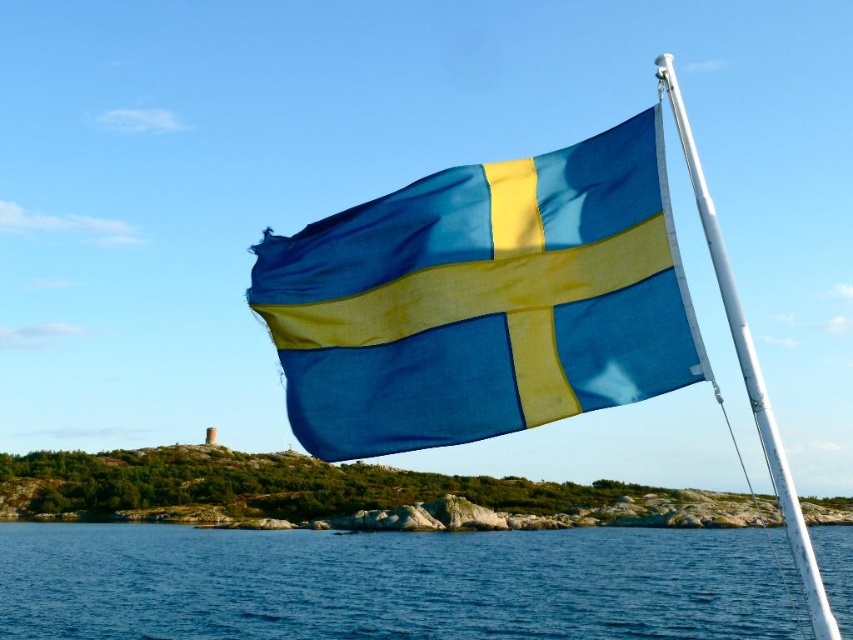
Is point (434, 380) farther from camera compared to point (773, 444)?

Yes, point (434, 380) is farther from viewer.

Who is taller, blue fabric flag at upper right or white metallic pole at upper right?

white metallic pole at upper right

What do you see at coordinates (483, 300) in the screenshot? Image resolution: width=853 pixels, height=640 pixels. I see `blue fabric flag at upper right` at bounding box center [483, 300].

The width and height of the screenshot is (853, 640). Identify the location of blue fabric flag at upper right. (483, 300).

How much distance is there between blue fabric flag at upper right and blue water at lower left?

A distance of 286.80 feet exists between blue fabric flag at upper right and blue water at lower left.

Is blue fabric flag at upper right positioned at the back of blue water at lower left?

Yes, it is behind blue water at lower left.

Measure the distance between blue fabric flag at upper right and camera.

13.75 meters

Identify the location of blue fabric flag at upper right. This screenshot has width=853, height=640. (483, 300).

Can you confirm if blue water at lower left is thinner than white metallic pole at upper right?

No.

Is blue water at lower left wider than white metallic pole at upper right?

Correct, the width of blue water at lower left exceeds that of white metallic pole at upper right.

Is point (527, 561) positioned behind point (770, 424)?

Yes, point (527, 561) is behind point (770, 424).

I want to click on blue water at lower left, so click(x=387, y=584).